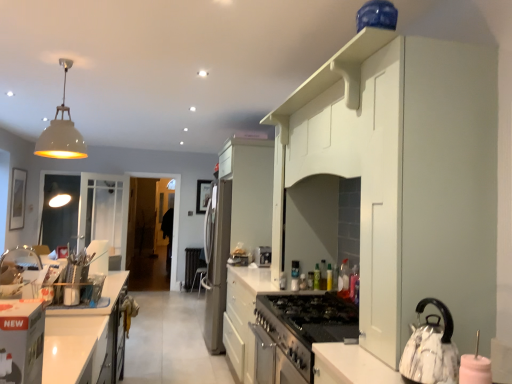
Question: From a real-world perspective, is white matte pendant light at upper left physically located above or below white glossy cabinet at center, arranged as the 1th cabinetry when ordered from the bottom?

Choices:
 (A) above
 (B) below

Answer: (A)

Question: In terms of height, does white matte pendant light at upper left look taller or shorter compared to white glossy cabinet at center, which is the 2th cabinetry in right-to-left order?

Choices:
 (A) short
 (B) tall

Answer: (A)

Question: Which is farther from the satin silver toaster at center, positioned as the 2th appliance in back-to-front order?

Choices:
 (A) translucent plastic bottle at center, which ranks as the third bottle in back-to-front order
 (B) translucent plastic bottle at center, the second bottle in the back-to-front sequence
 (C) white matte pendant light at upper left
 (D) translucent plastic bottle at center, acting as the 4th bottle starting from the back
 (E) white glossy cabinet at center, which is the 2th cabinetry in right-to-left order

Answer: (C)

Question: Considering the real-world distances, which object is closest to the blue glossy jar at upper center, which is counted as the first appliance, starting from the top?

Choices:
 (A) white matte pendant light at upper left
 (B) green matte bottle at center, the 5th bottle viewed from the front
 (C) satin stainless steel refrigerator at center, arranged as the fourth appliance when viewed from the top
 (D) translucent plastic bottle at center, the fifth bottle in the back-to-front sequence
 (E) white glossy countertop at lower left

Answer: (D)